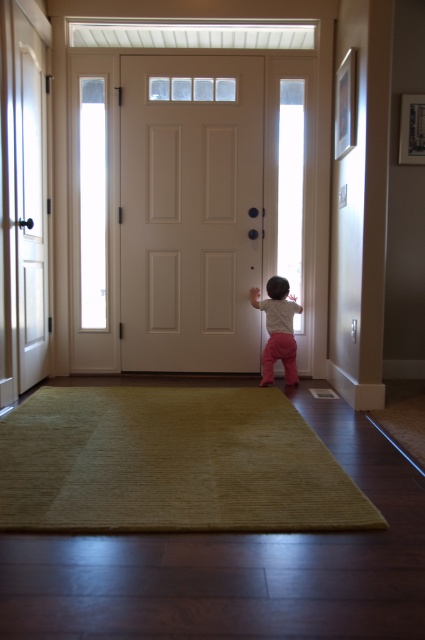
You are moving a large painting that is 1.8 meters tall. You need to pass through the hallway and exit through the white matte door at center. Can the painting fit vertically through the green soft rug at center area?

The green soft rug at center is shorter than the white matte door at center. Since the painting is 1.8 meters tall, the height of the white matte door at center must be greater than 1.8 meters for the painting to fit. However, the green soft rug at center being shorter than the door does not directly indicate its height relative to the painting. Without knowing the exact height of the door, it is uncertain if the painting can fit vertically through the green soft rug at center area.

You are a parent carrying a toddler and need to exit through the front door. The white matte door at center and the pink fabric toddler at center are both in your path. Which object is blocking your path more immediately?

The pink fabric toddler at center is blocking your path more immediately because it is positioned below the white matte door at center, meaning it is closer to you.

You are a parent trying to reach the front door while holding your pink fabric toddler at center. There is a green soft rug at center in the way. Can you step around the rug to the right side of the toddler?

The green soft rug at center is to the left of the pink fabric toddler at center, so yes, you can step around the rug to the right side of the pink fabric toddler at center.